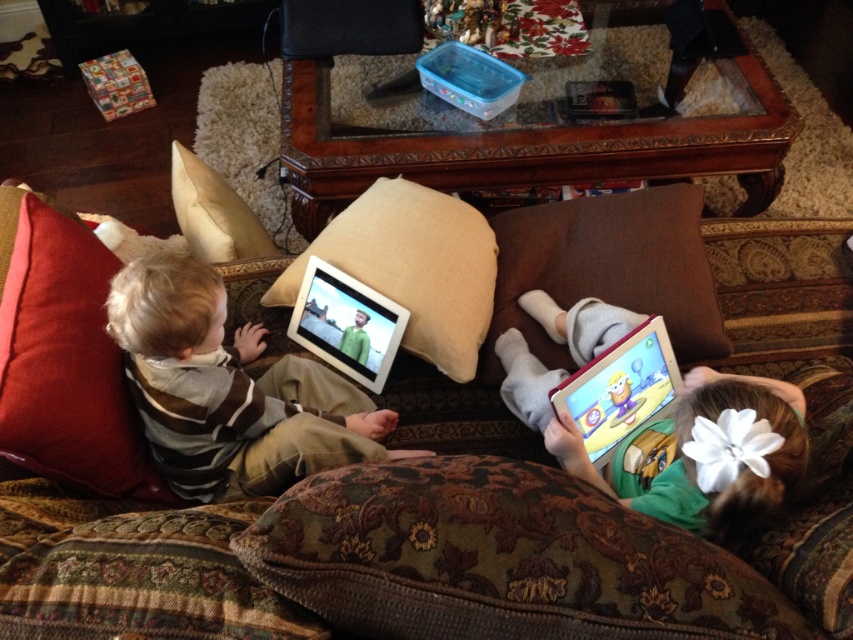
Is velvet-patterned couch at center further to camera compared to white fabric hair clip at upper right?

No, it is not.

Is point (566, 518) closer to viewer compared to point (788, 433)?

Yes.

Identify the location of velvet-patterned couch at center. (339, 563).

Is brown fabric pillow at right to the right of beige fabric pillow at upper left from the viewer's perspective?

Correct, you'll find brown fabric pillow at right to the right of beige fabric pillow at upper left.

Between brown fabric pillow at right and beige fabric pillow at upper left, which one has less height?

beige fabric pillow at upper left is shorter.

This screenshot has width=853, height=640. Describe the element at coordinates (607, 269) in the screenshot. I see `brown fabric pillow at right` at that location.

Locate an element on the screen. This screenshot has width=853, height=640. brown fabric pillow at right is located at coordinates (607, 269).

Between point (598, 403) and point (311, 298), which one is positioned in front?

Point (598, 403) is in front.

Does matte plastic tablet at lower right have a smaller size compared to white glossy tablet at center?

Incorrect, matte plastic tablet at lower right is not smaller in size than white glossy tablet at center.

Which is behind, point (627, 406) or point (329, 284)?

Point (329, 284)

In order to click on matte plastic tablet at lower right in this screenshot , I will do `click(619, 388)`.